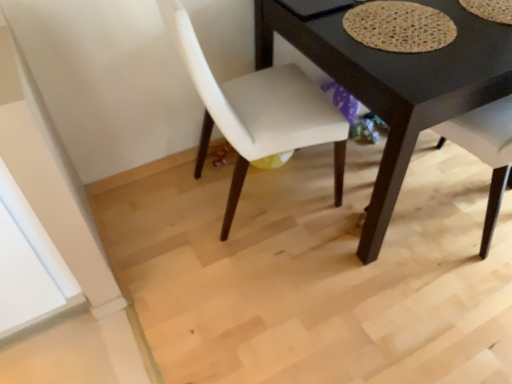
This screenshot has width=512, height=384. Identify the location of unoccupied area in front of black matte table at center. (366, 301).